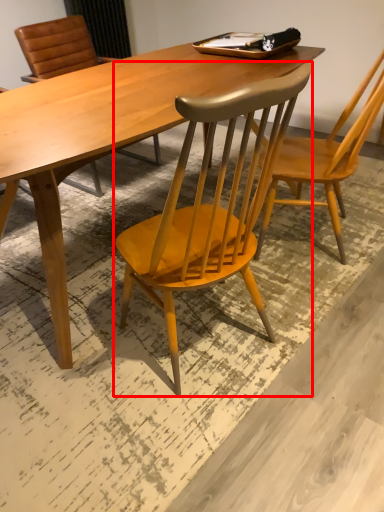
Question: Where is chair (annotated by the red box) located in relation to chair in the image?

Choices:
 (A) left
 (B) right

Answer: (A)